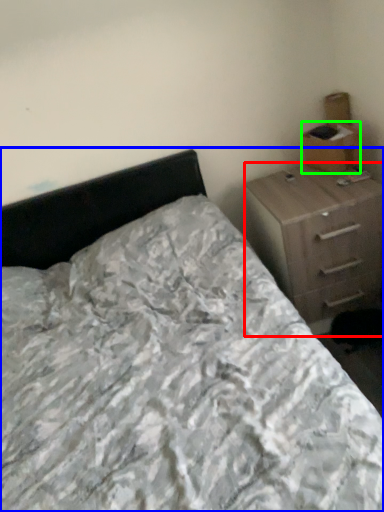
Question: Which object is the farthest from chest of drawers (highlighted by a red box)? Choose among these: bed (highlighted by a blue box) or cardboard box (highlighted by a green box).

Choices:
 (A) bed
 (B) cardboard box

Answer: (A)